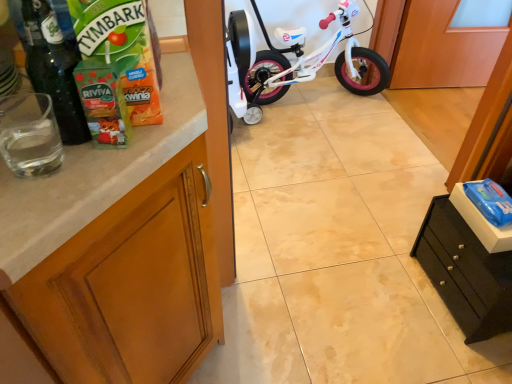
Where is `black matte drawer at lower right, positioned as the second cabinetry in left-to-right order`? The image size is (512, 384). black matte drawer at lower right, positioned as the second cabinetry in left-to-right order is located at coordinates (465, 272).

In the scene shown: Measure the distance between wooden cabinet at left, marked as the first cabinetry in a left-to-right arrangement, and camera.

A distance of 18.46 inches exists between wooden cabinet at left, marked as the first cabinetry in a left-to-right arrangement, and camera.

Image resolution: width=512 pixels, height=384 pixels. Find the location of `wooden cabinet at left, which is the second cabinetry in right-to-left order`. wooden cabinet at left, which is the second cabinetry in right-to-left order is located at coordinates (129, 284).

The width and height of the screenshot is (512, 384). Find the location of `white glossy bicycle at center`. white glossy bicycle at center is located at coordinates tap(296, 61).

Between white glossy bicycle at center and wooden cabinet at left, marked as the first cabinetry in a left-to-right arrangement, which one is positioned behind?

white glossy bicycle at center is more distant.

Between white glossy bicycle at center and wooden cabinet at left, which is the second cabinetry in right-to-left order, which one has less height?

Standing shorter between the two is white glossy bicycle at center.

From the image's perspective, is white glossy bicycle at center below wooden cabinet at left, which is the second cabinetry in right-to-left order?

No, from the image's perspective, white glossy bicycle at center is not below wooden cabinet at left, which is the second cabinetry in right-to-left order.

Image resolution: width=512 pixels, height=384 pixels. Identify the location of bicycle behind the wooden cabinet at left, marked as the first cabinetry in a left-to-right arrangement. (296, 61).

Locate an element on the screen. This screenshot has height=384, width=512. the 1st cabinetry in front of the white glossy bicycle at center, starting your count from the anchor is located at coordinates (465, 272).

Which object is thinner, white glossy bicycle at center or black matte drawer at lower right, positioned as the second cabinetry in left-to-right order?

Thinner between the two is black matte drawer at lower right, positioned as the second cabinetry in left-to-right order.

From the image's perspective, which one is positioned lower, white glossy bicycle at center or black matte drawer at lower right, positioned as the second cabinetry in left-to-right order?

From the image's view, black matte drawer at lower right, positioned as the second cabinetry in left-to-right order, is below.

From the picture: Considering the positions of objects white glossy bicycle at center and black matte drawer at lower right, positioned as the second cabinetry in left-to-right order, in the image provided, who is in front, white glossy bicycle at center or black matte drawer at lower right, positioned as the second cabinetry in left-to-right order,?

black matte drawer at lower right, positioned as the second cabinetry in left-to-right order.

Can you confirm if wooden cabinet at left, marked as the first cabinetry in a left-to-right arrangement, is shorter than black matte drawer at lower right, the first cabinetry positioned from the right?

Incorrect, the height of wooden cabinet at left, marked as the first cabinetry in a left-to-right arrangement, does not fall short of that of black matte drawer at lower right, the first cabinetry positioned from the right.

Are wooden cabinet at left, marked as the first cabinetry in a left-to-right arrangement, and black matte drawer at lower right, positioned as the second cabinetry in left-to-right order, located far from each other?

wooden cabinet at left, marked as the first cabinetry in a left-to-right arrangement, is near black matte drawer at lower right, positioned as the second cabinetry in left-to-right order, not far away.

Considering the sizes of objects wooden cabinet at left, which is the second cabinetry in right-to-left order, and black matte drawer at lower right, the first cabinetry positioned from the right, in the image provided, who is bigger, wooden cabinet at left, which is the second cabinetry in right-to-left order, or black matte drawer at lower right, the first cabinetry positioned from the right,?

With larger size is wooden cabinet at left, which is the second cabinetry in right-to-left order.

Which point is more forward, (212,292) or (457,287)?

The point (212,292) is closer.

Consider the image. How different are the orientations of black matte drawer at lower right, positioned as the second cabinetry in left-to-right order, and white glossy bicycle at center in degrees?

84.4 degrees separate the facing orientations of black matte drawer at lower right, positioned as the second cabinetry in left-to-right order, and white glossy bicycle at center.

Does point (472, 237) lie behind point (280, 59)?

No, it is not.

Choose the correct answer: Is black matte drawer at lower right, positioned as the second cabinetry in left-to-right order, inside white glossy bicycle at center or outside it?

black matte drawer at lower right, positioned as the second cabinetry in left-to-right order, is not enclosed by white glossy bicycle at center.

Who is taller, black matte drawer at lower right, positioned as the second cabinetry in left-to-right order, or white glossy bicycle at center?

Standing taller between the two is white glossy bicycle at center.

From the image's perspective, which one is positioned higher, wooden cabinet at left, which is the second cabinetry in right-to-left order, or white glossy bicycle at center?

white glossy bicycle at center appears higher in the image.

Would you consider wooden cabinet at left, which is the second cabinetry in right-to-left order, to be distant from white glossy bicycle at center?

Yes, wooden cabinet at left, which is the second cabinetry in right-to-left order, is far from white glossy bicycle at center.

Which point is more distant from viewer, (101, 246) or (346, 66)?

The point (346, 66) is behind.

Would you say white glossy bicycle at center is part of wooden cabinet at left, marked as the first cabinetry in a left-to-right arrangement,'s contents?

No, white glossy bicycle at center is not inside wooden cabinet at left, marked as the first cabinetry in a left-to-right arrangement.

Is point (449, 228) positioned behind point (200, 360)?

Yes, it is.

Considering the sizes of black matte drawer at lower right, positioned as the second cabinetry in left-to-right order, and wooden cabinet at left, which is the second cabinetry in right-to-left order, in the image, is black matte drawer at lower right, positioned as the second cabinetry in left-to-right order, taller or shorter than wooden cabinet at left, which is the second cabinetry in right-to-left order,?

Clearly, black matte drawer at lower right, positioned as the second cabinetry in left-to-right order, is shorter compared to wooden cabinet at left, which is the second cabinetry in right-to-left order.

Is wooden cabinet at left, marked as the first cabinetry in a left-to-right arrangement, at the back of black matte drawer at lower right, the first cabinetry positioned from the right?

No, black matte drawer at lower right, the first cabinetry positioned from the right, is not facing the opposite direction of wooden cabinet at left, marked as the first cabinetry in a left-to-right arrangement.

Is black matte drawer at lower right, the first cabinetry positioned from the right, wider or thinner than wooden cabinet at left, which is the second cabinetry in right-to-left order?

black matte drawer at lower right, the first cabinetry positioned from the right, is thinner than wooden cabinet at left, which is the second cabinetry in right-to-left order.

At what (x,y) coordinates should I click in order to perform the action: click on bicycle below the wooden cabinet at left, which is the second cabinetry in right-to-left order (from a real-world perspective). Please return your answer as a coordinate pair (x, y). Image resolution: width=512 pixels, height=384 pixels. Looking at the image, I should click on (296, 61).

Identify the location of cabinetry on the right of the white glossy bicycle at center. (465, 272).

When comparing their distances from black matte drawer at lower right, the first cabinetry positioned from the right, does white glossy bicycle at center or wooden cabinet at left, which is the second cabinetry in right-to-left order, seem closer?

wooden cabinet at left, which is the second cabinetry in right-to-left order.

From the image, which object appears to be farther from white glossy bicycle at center, black matte drawer at lower right, positioned as the second cabinetry in left-to-right order, or wooden cabinet at left, marked as the first cabinetry in a left-to-right arrangement?

wooden cabinet at left, marked as the first cabinetry in a left-to-right arrangement, lies further to white glossy bicycle at center than the other object.

Based on their spatial positions, is wooden cabinet at left, marked as the first cabinetry in a left-to-right arrangement, or black matte drawer at lower right, positioned as the second cabinetry in left-to-right order, closer to white glossy bicycle at center?

black matte drawer at lower right, positioned as the second cabinetry in left-to-right order, is closer to white glossy bicycle at center.

From the image, which object appears to be nearer to wooden cabinet at left, marked as the first cabinetry in a left-to-right arrangement, black matte drawer at lower right, positioned as the second cabinetry in left-to-right order, or white glossy bicycle at center?

The object closer to wooden cabinet at left, marked as the first cabinetry in a left-to-right arrangement, is black matte drawer at lower right, positioned as the second cabinetry in left-to-right order.

Which object lies further to the anchor point black matte drawer at lower right, positioned as the second cabinetry in left-to-right order, wooden cabinet at left, marked as the first cabinetry in a left-to-right arrangement, or white glossy bicycle at center?

Among the two, white glossy bicycle at center is located further to black matte drawer at lower right, positioned as the second cabinetry in left-to-right order.

Which object lies further to the anchor point wooden cabinet at left, which is the second cabinetry in right-to-left order, white glossy bicycle at center or black matte drawer at lower right, positioned as the second cabinetry in left-to-right order?

white glossy bicycle at center.

Where is `cabinetry between wooden cabinet at left, which is the second cabinetry in right-to-left order, and white glossy bicycle at center in the front-back direction`? This screenshot has height=384, width=512. cabinetry between wooden cabinet at left, which is the second cabinetry in right-to-left order, and white glossy bicycle at center in the front-back direction is located at coordinates (465, 272).